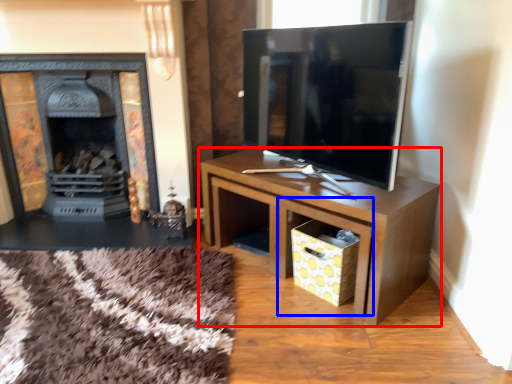
Question: Which point is further to the camera, table (highlighted by a red box) or drawer (highlighted by a blue box)?

Choices:
 (A) table
 (B) drawer

Answer: (B)